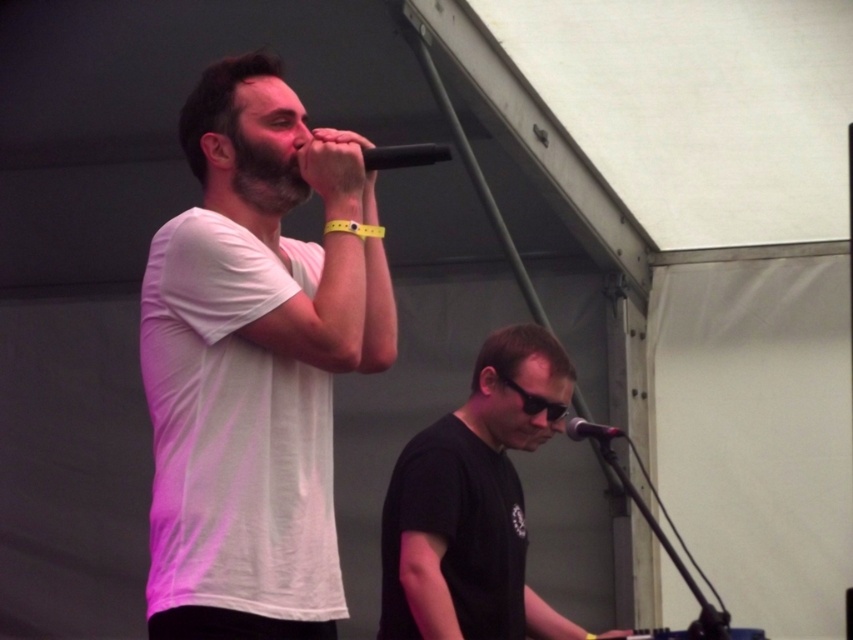
Where is `black matte shirt at lower right`? This screenshot has height=640, width=853. black matte shirt at lower right is located at coordinates (474, 502).

Which is behind, point (399, 520) or point (465, 499)?

The point (465, 499) is behind.

Locate an element on the screen. This screenshot has width=853, height=640. black matte shirt at lower right is located at coordinates (474, 502).

Which of these two, black matte t-shirt at lower right or black metallic microphone at center, stands taller?

black matte t-shirt at lower right is taller.

At what (x,y) coordinates should I click in order to perform the action: click on black matte t-shirt at lower right. Please return your answer as a coordinate pair (x, y). The height and width of the screenshot is (640, 853). Looking at the image, I should click on (457, 531).

Locate an element on the screen. white matte t-shirt at center is located at coordinates (254, 364).